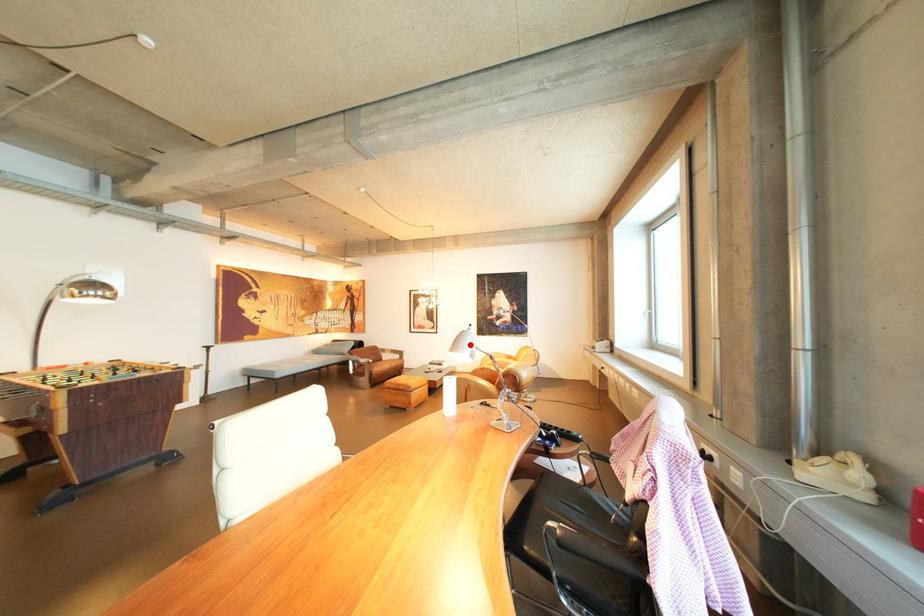
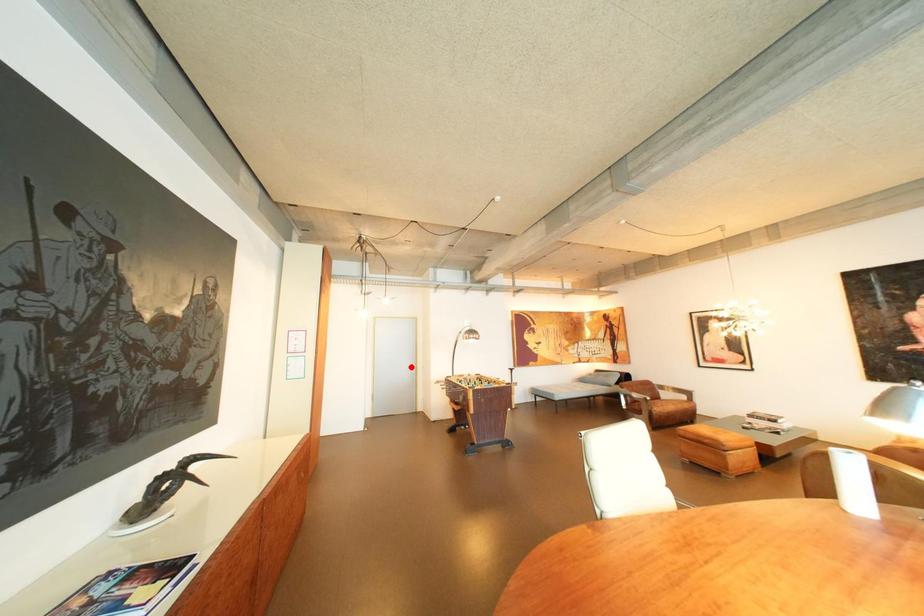
I am providing you with two images of the same scene from different viewpoints. A red point is marked on the first image and another point is marked on the second image. Is the red point in image1 aligned with the point shown in image2?

No